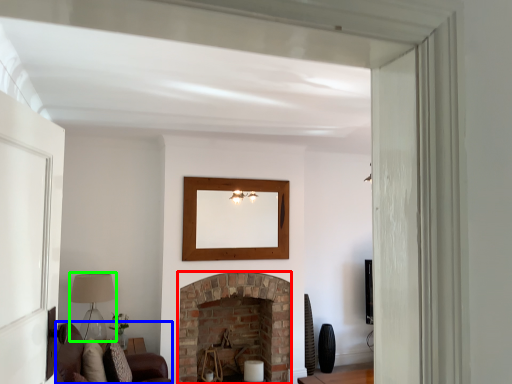
Question: Which object is positioned farthest from fireplace (highlighted by a red box)? Select from couch (highlighted by a blue box) and lamp (highlighted by a green box).

Choices:
 (A) couch
 (B) lamp

Answer: (B)